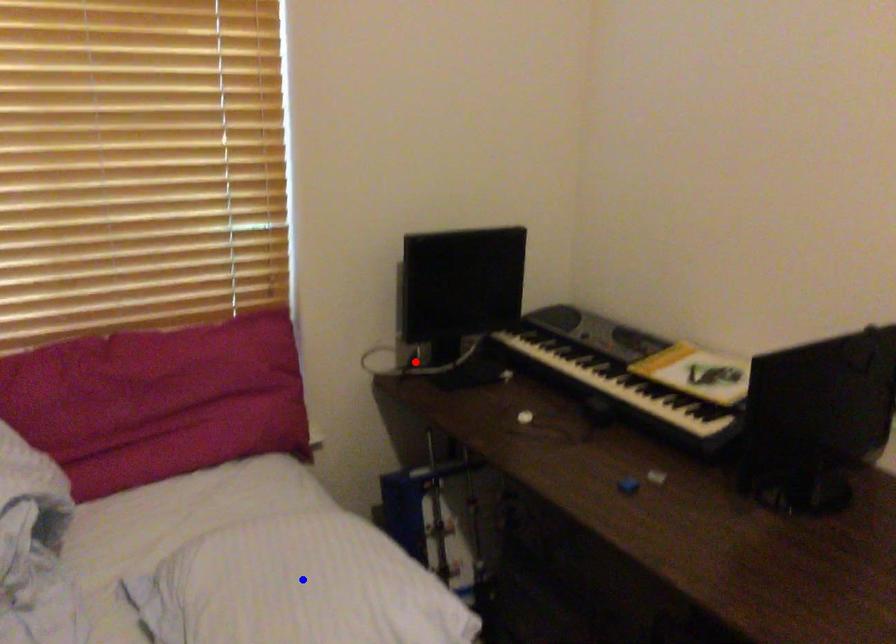
Question: Two points are marked on the image. Which point is closer to the camera?

Choices:
 (A) Blue point is closer.
 (B) Red point is closer.

Answer: (A)